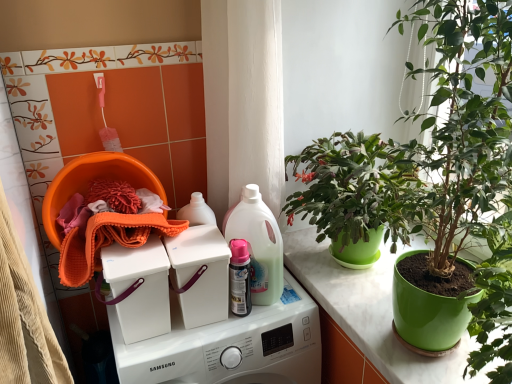
Find the location of a particular element. vacant space situated on the left part of pink glossy spray can at center is located at coordinates (184, 331).